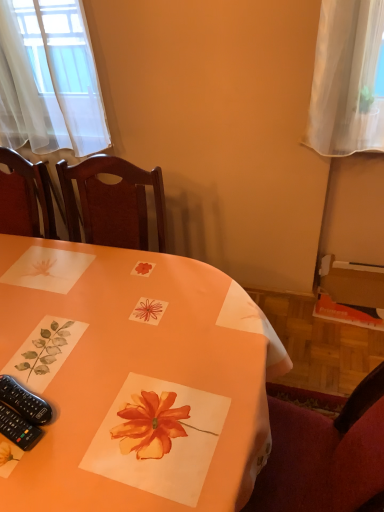
This screenshot has width=384, height=512. In order to click on unoccupied region to the right of black plastic remote control at lower left, the first remote control positioned from the bottom in this screenshot , I will do `click(94, 418)`.